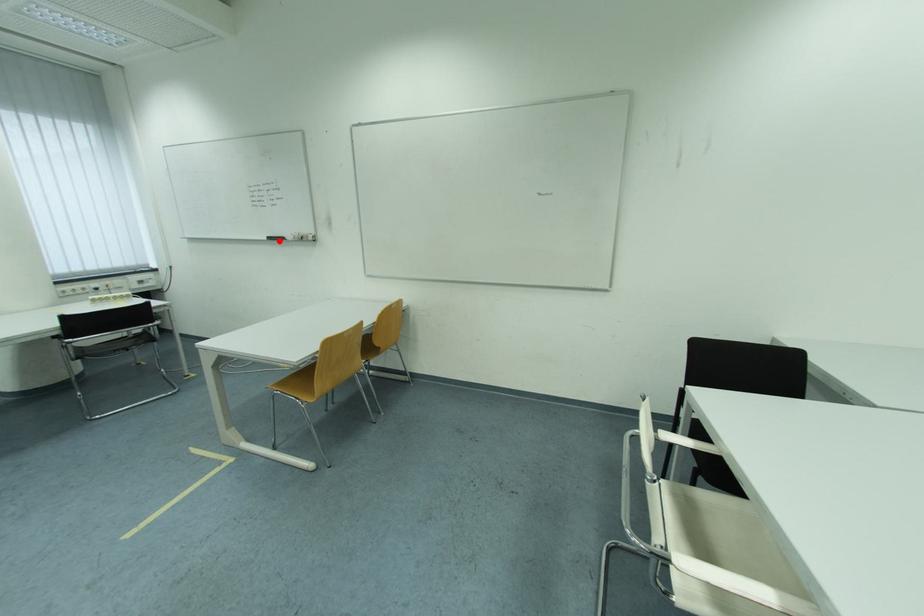
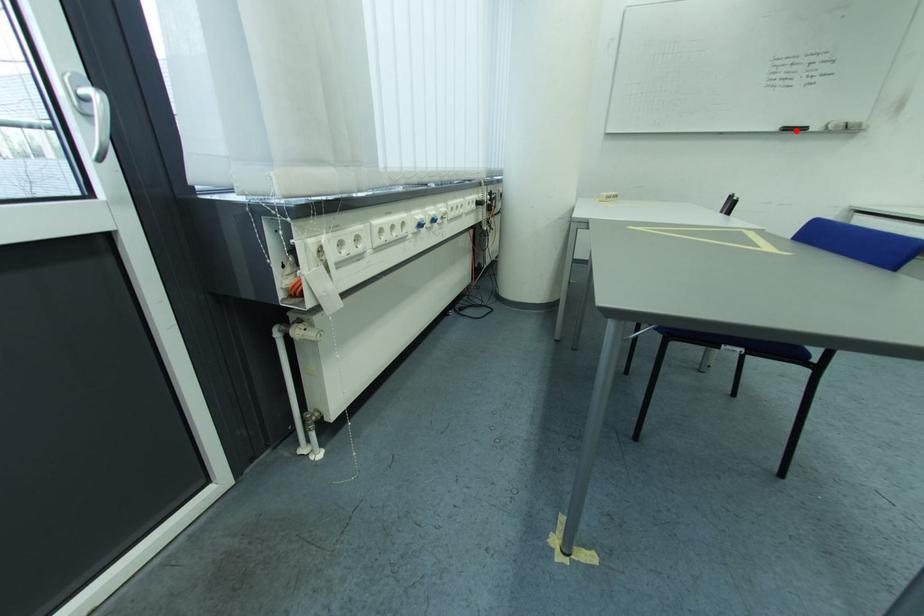
I am providing you with two images of the same scene from different viewpoints. A red point is marked on the first image and another point is marked on the second image. Do the highlighted points in image1 and image2 indicate the same real-world spot?

Yes